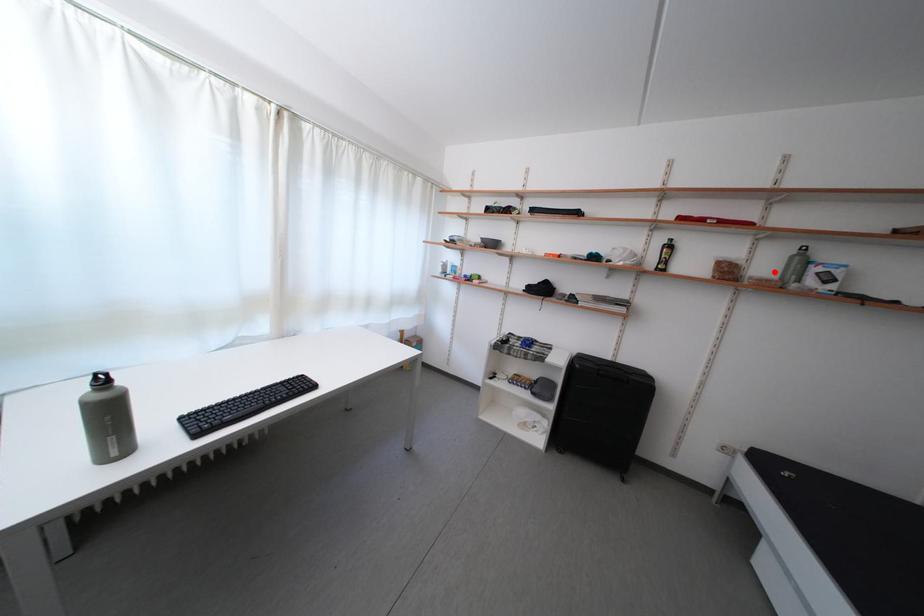
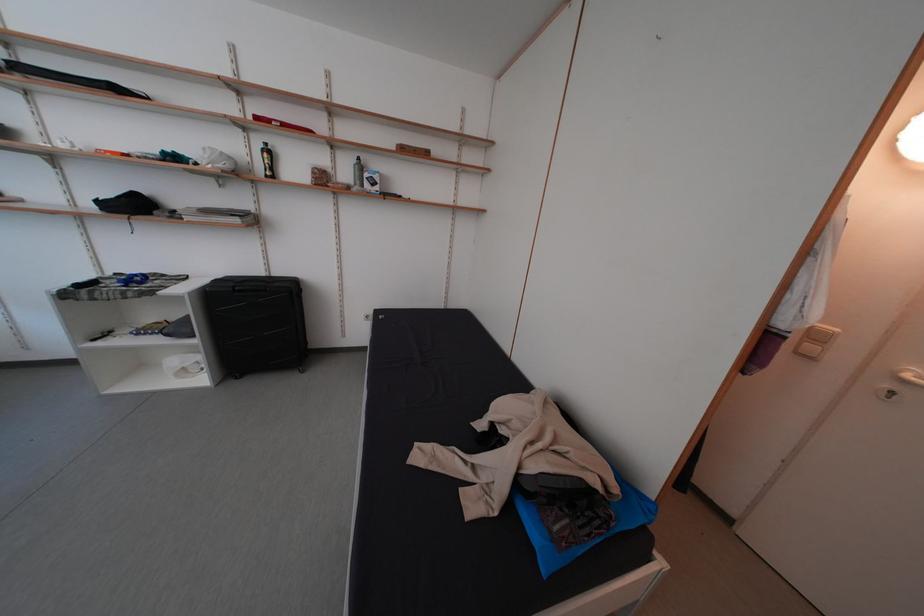
Where in the second image is the point corresponding to the highlighted location from the first image?

(354, 179)